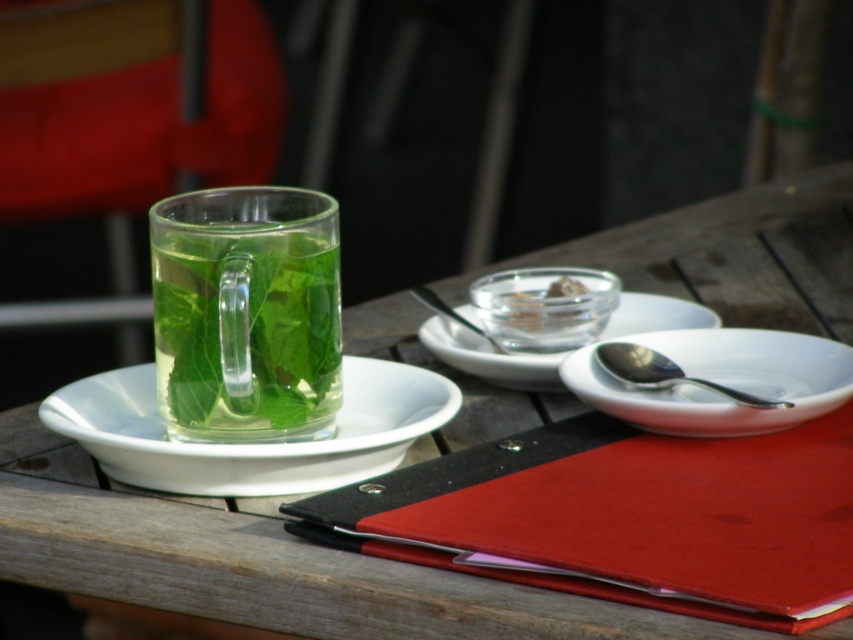
Which is below, transparent glass cup at upper left or translucent glass bowl at center?

transparent glass cup at upper left is below.

Can you confirm if transparent glass cup at upper left is shorter than translucent glass bowl at center?

In fact, transparent glass cup at upper left may be taller than translucent glass bowl at center.

Who is more forward, (582, 250) or (515, 326)?

Positioned in front is point (515, 326).

Where is `transparent glass cup at upper left`? This screenshot has height=640, width=853. transparent glass cup at upper left is located at coordinates (257, 563).

Which is below, transparent glass mug at left or silver metallic spoon at upper right?

silver metallic spoon at upper right

From the picture: Does transparent glass mug at left have a lesser height compared to silver metallic spoon at upper right?

No, transparent glass mug at left is not shorter than silver metallic spoon at upper right.

Which is in front, point (257, 342) or point (607, 340)?

Point (257, 342) is more forward.

You are a GUI agent. You are given a task and a screenshot of the screen. Output one action in this format:
    pyautogui.click(x=<x>, y=<y>)
    Task: Click on the transparent glass mug at left
    This screenshot has height=640, width=853.
    Given the screenshot: What is the action you would take?
    pyautogui.click(x=247, y=314)

Who is more distant from viewer, (236, 580) or (697, 364)?

The point (697, 364) is more distant.

Locate an element on the screen. The image size is (853, 640). transparent glass cup at upper left is located at coordinates (257, 563).

The height and width of the screenshot is (640, 853). Find the location of `transparent glass cup at upper left`. transparent glass cup at upper left is located at coordinates (257, 563).

Find the location of `transparent glass cup at upper left`. transparent glass cup at upper left is located at coordinates (257, 563).